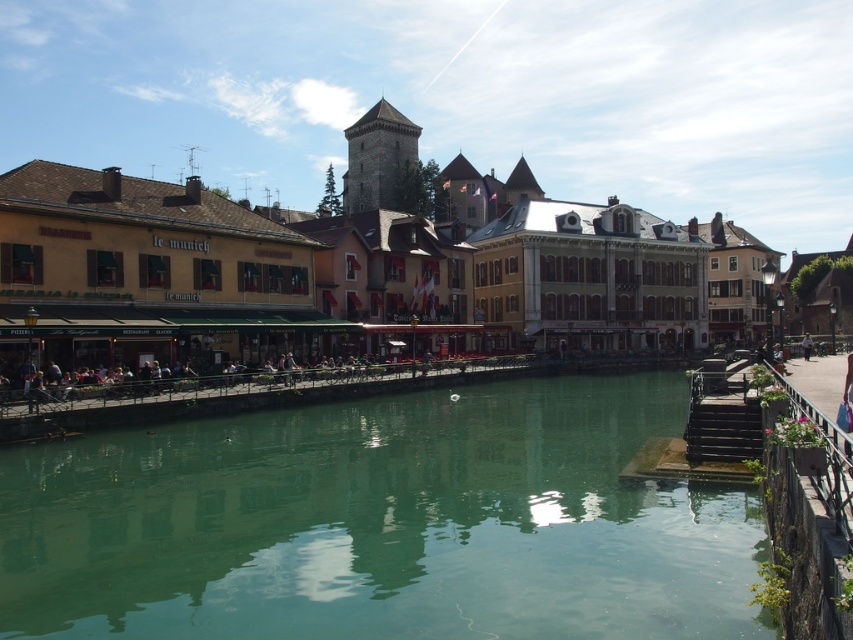
Which is more to the left, green reflective water at lower center or dark gray stone tower at center?

dark gray stone tower at center is more to the left.

Between green reflective water at lower center and dark gray stone tower at center, which one is positioned higher?

Positioned higher is dark gray stone tower at center.

Is point (479, 618) positioned behind point (355, 205)?

That is False.

This screenshot has height=640, width=853. Find the location of `green reflective water at lower center`. green reflective water at lower center is located at coordinates (381, 522).

Is point (753, 403) closer to viewer compared to point (809, 356)?

Yes.

Is point (746, 381) positioned behind point (805, 353)?

That is False.

The height and width of the screenshot is (640, 853). Find the location of `wooden stairs at lower right`. wooden stairs at lower right is located at coordinates (722, 416).

Between dark gray stone tower at center and light brown leather jacket at center, which one appears on the right side from the viewer's perspective?

From the viewer's perspective, light brown leather jacket at center appears more on the right side.

Does dark gray stone tower at center lie in front of light brown leather jacket at center?

No, it is not.

You are a GUI agent. You are given a task and a screenshot of the screen. Output one action in this format:
    pyautogui.click(x=<x>, y=<y>)
    Task: Click on the dark gray stone tower at center
    Image resolution: width=853 pixels, height=640 pixels.
    Given the screenshot: What is the action you would take?
    pyautogui.click(x=376, y=157)